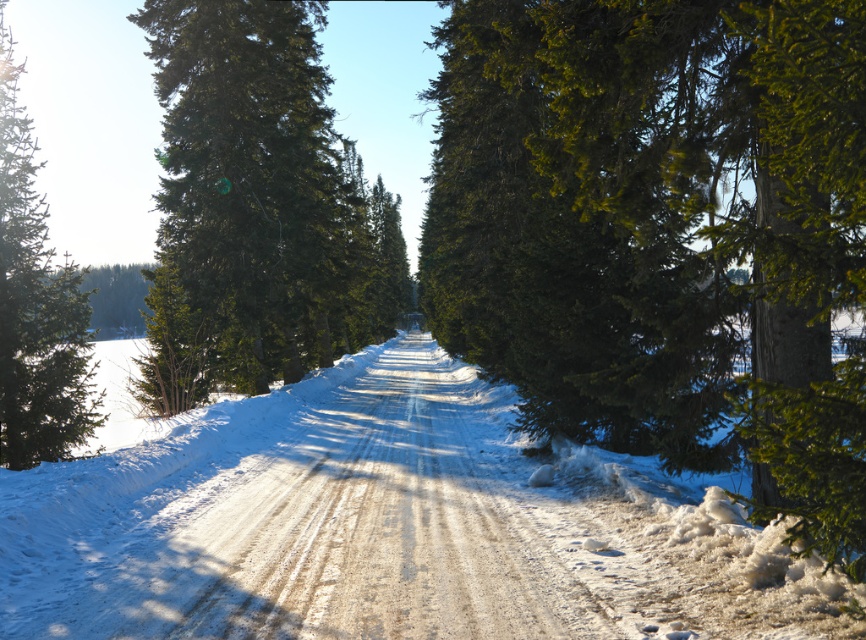
Does green textured pine tree at center appear over green matte evergreen tree at left?

No, green textured pine tree at center is not above green matte evergreen tree at left.

Does green textured pine tree at center come in front of green matte evergreen tree at left?

Yes, green textured pine tree at center is closer to the viewer.

This screenshot has height=640, width=866. Identify the location of green textured pine tree at center. (662, 232).

Who is positioned more to the right, green matte tree at center or green matte evergreen tree at left?

green matte tree at center is more to the right.

Is point (167, 256) positioned before point (62, 353)?

No, (167, 256) is further to viewer.

Identify the location of green matte tree at center. This screenshot has height=640, width=866. (257, 208).

Which is more to the right, green textured pine tree at center or green matte tree at center?

Positioned to the right is green textured pine tree at center.

Is point (835, 472) behind point (285, 76)?

No, (835, 472) is in front of (285, 76).

Identify the location of green textured pine tree at center. (662, 232).